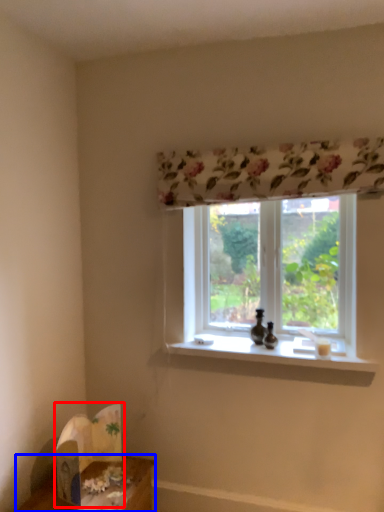
Question: Which object appears farthest to the camera in this image, cardboard box (highlighted by a red box) or table (highlighted by a blue box)?

Choices:
 (A) cardboard box
 (B) table

Answer: (A)